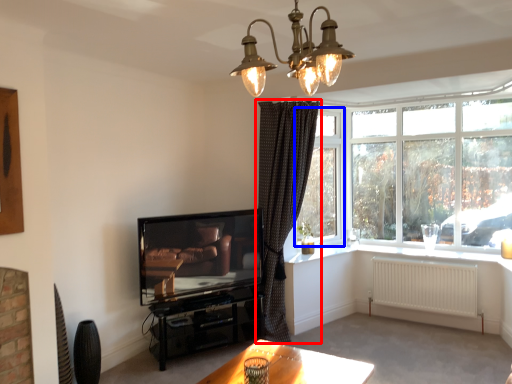
Question: Which point is further to the camera, curtain (highlighted by a red box) or window screen (highlighted by a blue box)?

Choices:
 (A) curtain
 (B) window screen

Answer: (B)